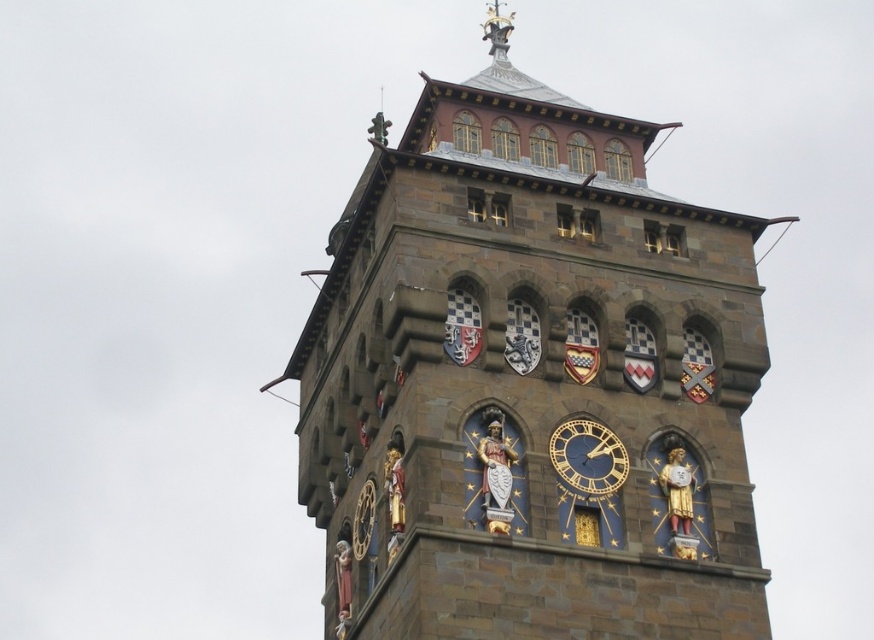
You are standing in front of the brown stone clock tower at center and the gold metallic clock at center. Which object is closer to you?

The brown stone clock tower at center is closer to you because it is in front of the gold metallic clock at center.

You are standing in front of the clock tower and notice two points marked on the image. The first point is at coordinates point (618, 481) and the second is at point (510, 19). Which of these points is nearer to you?

Point (618, 481) is closer to the camera than point (510, 19).

You are standing in front of the brown stone clock tower at center and the polished brass statue at upper center. Which object is positioned to the right side?

The polished brass statue at upper center is positioned to the right of the brown stone clock tower at center.